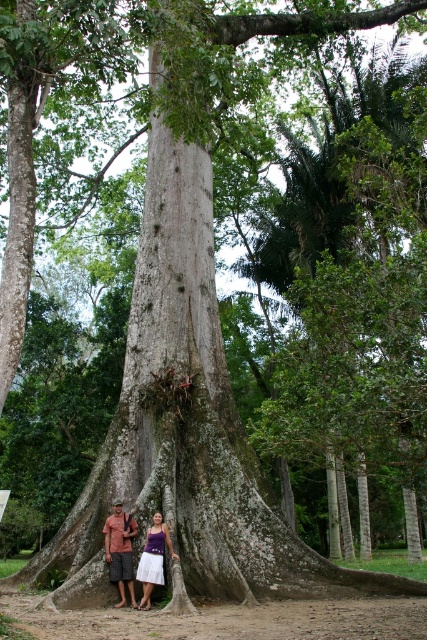
Question: Does brown cotton shirt at lower center have a lesser width compared to white cotton dress at lower center?

Choices:
 (A) yes
 (B) no

Answer: (A)

Question: Which object is farther from the camera taking this photo?

Choices:
 (A) white cotton dress at lower center
 (B) white cotton dress at center

Answer: (B)

Question: Which of the following is the closest to the observer?

Choices:
 (A) white cotton dress at lower center
 (B) brown cotton shirt at lower center
 (C) white cotton dress at center

Answer: (A)

Question: Which point is closer to the camera?

Choices:
 (A) (114, 564)
 (B) (151, 529)

Answer: (A)

Question: In this image, where is white cotton dress at center located relative to brown cotton shirt at lower center?

Choices:
 (A) below
 (B) above

Answer: (B)

Question: Can you confirm if white cotton dress at center is bigger than white cotton dress at lower center?

Choices:
 (A) no
 (B) yes

Answer: (B)